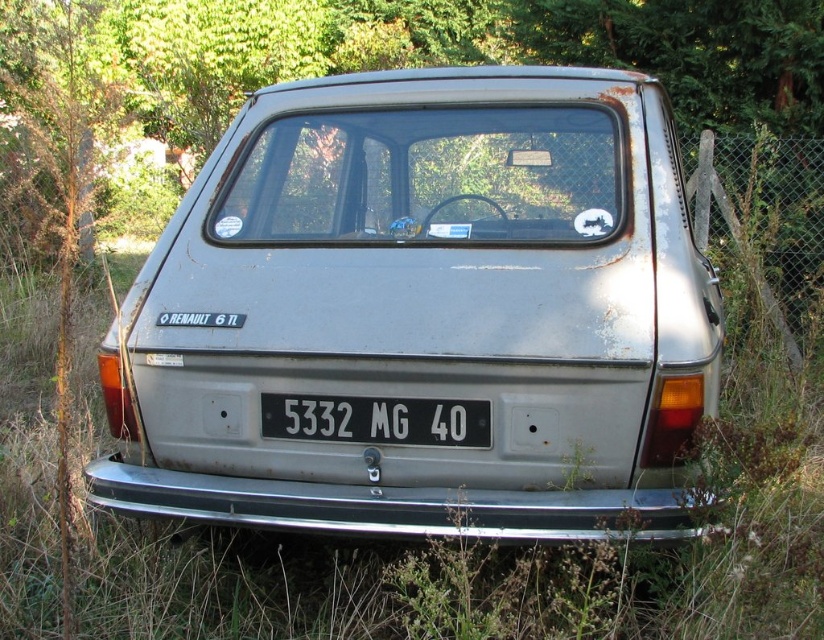
Question: From the image, what is the correct spatial relationship of rusty metal car at center in relation to white plastic license plate at center?

Choices:
 (A) below
 (B) above

Answer: (B)

Question: Observing the image, what is the correct spatial positioning of rusty metal car at center in reference to white plastic license plate at center?

Choices:
 (A) left
 (B) right

Answer: (B)

Question: Can you confirm if rusty metal car at center is positioned above white plastic license plate at center?

Choices:
 (A) no
 (B) yes

Answer: (B)

Question: Which object appears closest to the camera in this image?

Choices:
 (A) rusty metal car at center
 (B) white plastic license plate at center

Answer: (A)

Question: Which point is farther from the camera taking this photo?

Choices:
 (A) click(432, 400)
 (B) click(644, 476)

Answer: (A)

Question: Which point is farther to the camera?

Choices:
 (A) white plastic license plate at center
 (B) rusty metal car at center

Answer: (A)